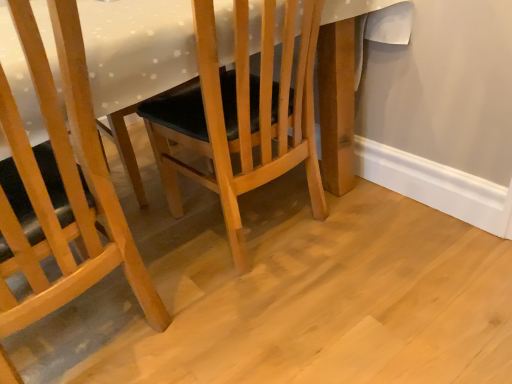
Question: From their relative heights in the image, would you say white glossy table at center is taller or shorter than wooden chair at center, which is the first chair from right to left?

Choices:
 (A) short
 (B) tall

Answer: (A)

Question: From a real-world perspective, is white glossy table at center positioned above or below wooden chair at center, which is the first chair from right to left?

Choices:
 (A) below
 (B) above

Answer: (A)

Question: Considering the real-world distances, which object is farthest from the matte wood chair at center, marked as the first chair in a left-to-right arrangement?

Choices:
 (A) white glossy table at center
 (B) wooden chair at center, which is the first chair from right to left

Answer: (B)

Question: Considering the real-world distances, which object is farthest from the matte wood chair at center, the second chair in the right-to-left sequence?

Choices:
 (A) white glossy table at center
 (B) wooden chair at center, which is counted as the 2th chair, starting from the left

Answer: (B)